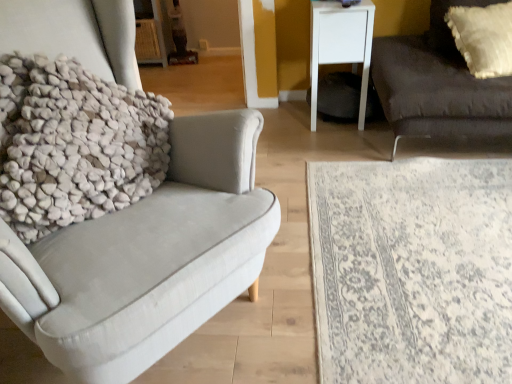
Question: Is white textured pillow at left taller than white textured pillow at upper right?

Choices:
 (A) yes
 (B) no

Answer: (A)

Question: Does white textured pillow at left lie behind white textured pillow at upper right?

Choices:
 (A) no
 (B) yes

Answer: (A)

Question: Is white textured pillow at left positioned in front of white textured pillow at upper right?

Choices:
 (A) no
 (B) yes

Answer: (B)

Question: Is white textured pillow at left to the right of white textured pillow at upper right from the viewer's perspective?

Choices:
 (A) no
 (B) yes

Answer: (A)

Question: Can you confirm if white textured pillow at left is smaller than white textured pillow at upper right?

Choices:
 (A) no
 (B) yes

Answer: (A)

Question: From the image's perspective, would you say white textured pillow at left is positioned over white textured pillow at upper right?

Choices:
 (A) no
 (B) yes

Answer: (A)

Question: Considering the relative sizes of white textured pillow at upper right and white textured pillow at left in the image provided, is white textured pillow at upper right thinner than white textured pillow at left?

Choices:
 (A) yes
 (B) no

Answer: (B)

Question: Is white textured pillow at upper right beside white textured pillow at left?

Choices:
 (A) yes
 (B) no

Answer: (B)

Question: Is the depth of white textured pillow at upper right greater than that of white textured pillow at left?

Choices:
 (A) no
 (B) yes

Answer: (B)

Question: From the image's perspective, is white textured pillow at upper right located above white textured pillow at left?

Choices:
 (A) yes
 (B) no

Answer: (A)

Question: Does white textured pillow at upper right have a lesser height compared to white textured pillow at left?

Choices:
 (A) no
 (B) yes

Answer: (B)

Question: Does white textured pillow at upper right appear on the left side of white textured pillow at left?

Choices:
 (A) yes
 (B) no

Answer: (B)

Question: Does dark gray fabric couch at right appear on the left side of white textured rug at lower right?

Choices:
 (A) yes
 (B) no

Answer: (B)